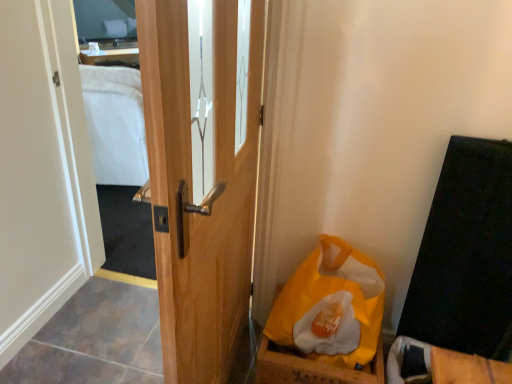
Locate an element on the screen. This screenshot has height=384, width=512. yellow paper bag at lower right is located at coordinates (x=332, y=305).

Image resolution: width=512 pixels, height=384 pixels. What do you see at coordinates (119, 162) in the screenshot? I see `clear glass mirror at upper left` at bounding box center [119, 162].

What are the coordinates of `wooden door at center` in the screenshot? It's located at 201,175.

At what (x,y) coordinates should I click in order to perform the action: click on yellow paper bag at lower right. Please return your answer as a coordinate pair (x, y). Looking at the image, I should click on (332, 305).

Who is shorter, clear glass mirror at upper left or yellow paper bag at lower right?

→ yellow paper bag at lower right.

Is clear glass mirror at upper left facing away from yellow paper bag at lower right?

No, clear glass mirror at upper left is not facing the opposite direction of yellow paper bag at lower right.

What's the angular difference between clear glass mirror at upper left and yellow paper bag at lower right's facing directions?

1.72 degrees.

From the picture: From a real-world perspective, is yellow paper bag at lower right positioned over wooden door at center based on gravity?

No.

Considering the relative positions of yellow paper bag at lower right and wooden door at center in the image provided, is yellow paper bag at lower right to the right of wooden door at center from the viewer's perspective?

Yes.

Which of these two, yellow paper bag at lower right or wooden door at center, is bigger?

wooden door at center.

Based on the photo, is yellow paper bag at lower right looking in the opposite direction of wooden door at center?

That's not correct — yellow paper bag at lower right is not looking away from wooden door at center.

You are a GUI agent. You are given a task and a screenshot of the screen. Output one action in this format:
    pyautogui.click(x=<x>, y=<y>)
    Task: Click on the mirror that appears above the yellow paper bag at lower right (from the image's perspective)
    
    Given the screenshot: What is the action you would take?
    pyautogui.click(x=119, y=162)

Which of these two, yellow paper bag at lower right or clear glass mirror at upper left, is wider?

With larger width is yellow paper bag at lower right.

Considering the positions of objects yellow paper bag at lower right and clear glass mirror at upper left in the image provided, who is more to the left, yellow paper bag at lower right or clear glass mirror at upper left?

From the viewer's perspective, clear glass mirror at upper left appears more on the left side.

How much distance is there between yellow paper bag at lower right and clear glass mirror at upper left?

yellow paper bag at lower right is 1.22 meters away from clear glass mirror at upper left.

From a real-world perspective, is wooden door at center physically below yellow paper bag at lower right?

No.

Which point is more forward, (230, 36) or (335, 342)?

Point (230, 36)

From the image's perspective, which one is positioned higher, wooden door at center or yellow paper bag at lower right?

wooden door at center, from the image's perspective.

Can you tell me how much wooden door at center and yellow paper bag at lower right differ in facing direction?

There is a 89.8-degree angle between the facing directions of wooden door at center and yellow paper bag at lower right.

Which is nearer, (x=88, y=97) or (x=238, y=49)?

The point (x=238, y=49) is in front.

Considering their positions, is clear glass mirror at upper left located in front of or behind wooden door at center?

In the image, clear glass mirror at upper left appears behind wooden door at center.

From the image's perspective, is clear glass mirror at upper left beneath wooden door at center?

Incorrect, from the image's perspective, clear glass mirror at upper left is higher than wooden door at center.

From the image's perspective, would you say wooden door at center is shown under clear glass mirror at upper left?

Yes, from the image's perspective, wooden door at center is beneath clear glass mirror at upper left.

Is wooden door at center taller or shorter than clear glass mirror at upper left?

Clearly, wooden door at center is taller compared to clear glass mirror at upper left.

Which object is closer to the camera taking this photo, wooden door at center or clear glass mirror at upper left?

Positioned in front is wooden door at center.

Looking at this image, is wooden door at center not near clear glass mirror at upper left?

wooden door at center is positioned a significant distance from clear glass mirror at upper left.

Locate an element on the screen. The width and height of the screenshot is (512, 384). mirror located above the yellow paper bag at lower right (from the image's perspective) is located at coordinates (119, 162).

The image size is (512, 384). I want to click on paper bag that appears on the right of wooden door at center, so click(x=332, y=305).

Based on the photo, estimate the real-world distances between objects in this image. Which object is closer to yellow paper bag at lower right, clear glass mirror at upper left or wooden door at center?

Among the two, wooden door at center is located nearer to yellow paper bag at lower right.

Based on their spatial positions, is yellow paper bag at lower right or clear glass mirror at upper left further from wooden door at center?

clear glass mirror at upper left.

Estimate the real-world distances between objects in this image. Which object is closer to clear glass mirror at upper left, yellow paper bag at lower right or wooden door at center?

wooden door at center lies closer to clear glass mirror at upper left than the other object.

Which object lies further to the anchor point yellow paper bag at lower right, wooden door at center or clear glass mirror at upper left?

clear glass mirror at upper left.

When comparing their distances from wooden door at center, does clear glass mirror at upper left or yellow paper bag at lower right seem further?

clear glass mirror at upper left.

From the image, which object appears to be nearer to clear glass mirror at upper left, wooden door at center or yellow paper bag at lower right?

wooden door at center.

The image size is (512, 384). What are the coordinates of `door between clear glass mirror at upper left and yellow paper bag at lower right` in the screenshot? It's located at (201, 175).